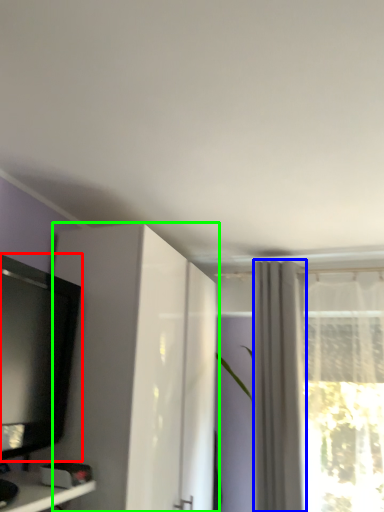
Question: Which is nearer to the television (highlighted by a red box)? curtain (highlighted by a blue box) or cabinetry (highlighted by a green box).

Choices:
 (A) curtain
 (B) cabinetry

Answer: (B)